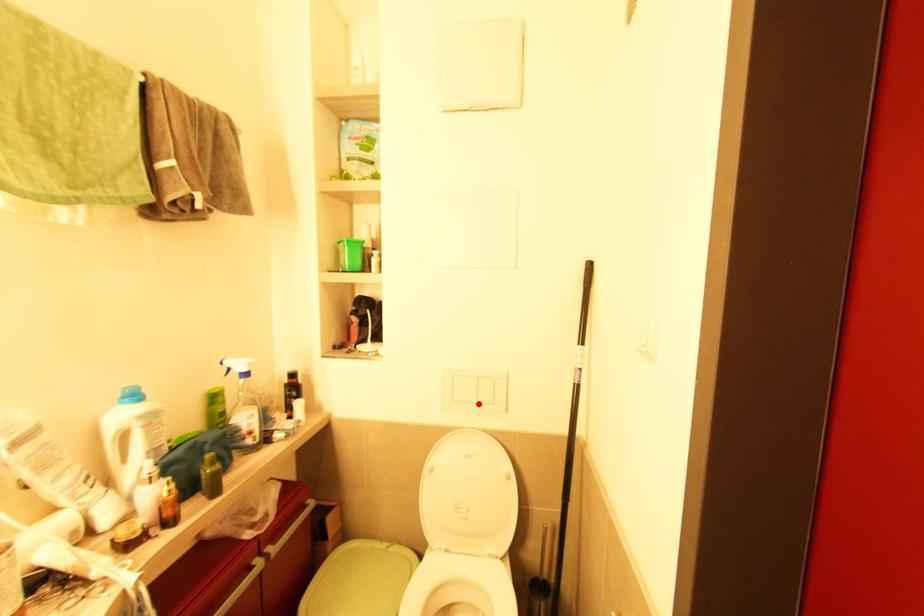
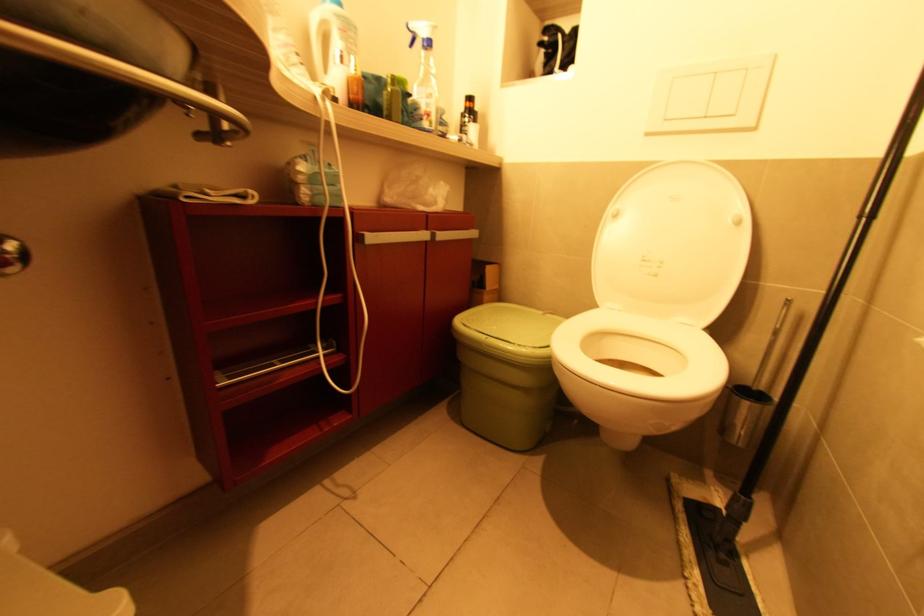
Locate, in the second image, the point that corresponds to the highlighted location in the first image.

(709, 118)